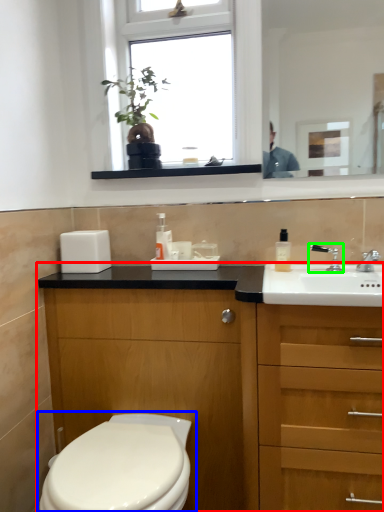
Question: Based on their relative distances, which object is nearer to bathroom cabinet (highlighted by a red box)? Choose from toilet (highlighted by a blue box) and tap (highlighted by a green box).

Choices:
 (A) toilet
 (B) tap

Answer: (A)